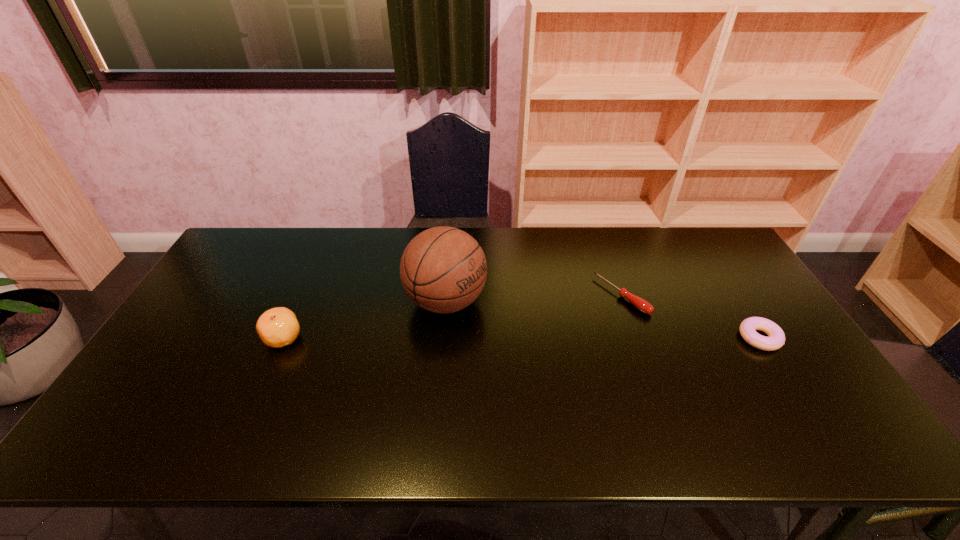
In the image, there is a desktop. At what (x,y) coordinates should I click in order to perform the action: click on vacant region at the near right corner. Please return your answer as a coordinate pair (x, y). Image resolution: width=960 pixels, height=540 pixels. Looking at the image, I should click on (826, 389).

At what (x,y) coordinates should I click in order to perform the action: click on vacant area that lies between the clementine and the screwdriver. Please return your answer as a coordinate pair (x, y). The image size is (960, 540). Looking at the image, I should click on (452, 317).

This screenshot has width=960, height=540. Find the location of `vacant space in between the clementine and the doughnut`. vacant space in between the clementine and the doughnut is located at coordinates [x=521, y=338].

At what (x,y) coordinates should I click in order to perform the action: click on unoccupied position between the second tallest object and the third object from left to right. Please return your answer as a coordinate pair (x, y). Looking at the image, I should click on (452, 317).

Locate an element on the screen. vacant region between the second tallest object and the second object from left to right is located at coordinates (365, 319).

You are a GUI agent. You are given a task and a screenshot of the screen. Output one action in this format:
    pyautogui.click(x=<x>, y=<y>)
    Task: Click on the vacant region between the doughnut and the leftmost object
    The image size is (960, 540).
    Given the screenshot: What is the action you would take?
    pyautogui.click(x=521, y=338)

At what (x,y) coordinates should I click in order to perform the action: click on free spot between the clementine and the rightmost object. Please return your answer as a coordinate pair (x, y). Looking at the image, I should click on (521, 338).

I want to click on vacant space that's between the second object from right to left and the clementine, so [452, 317].

Find the location of a particular element. This screenshot has width=960, height=540. vacant area between the doughnut and the leftmost object is located at coordinates (521, 338).

The image size is (960, 540). Find the location of `unoccupied position between the second object from left to right and the rightmost object`. unoccupied position between the second object from left to right and the rightmost object is located at coordinates (603, 320).